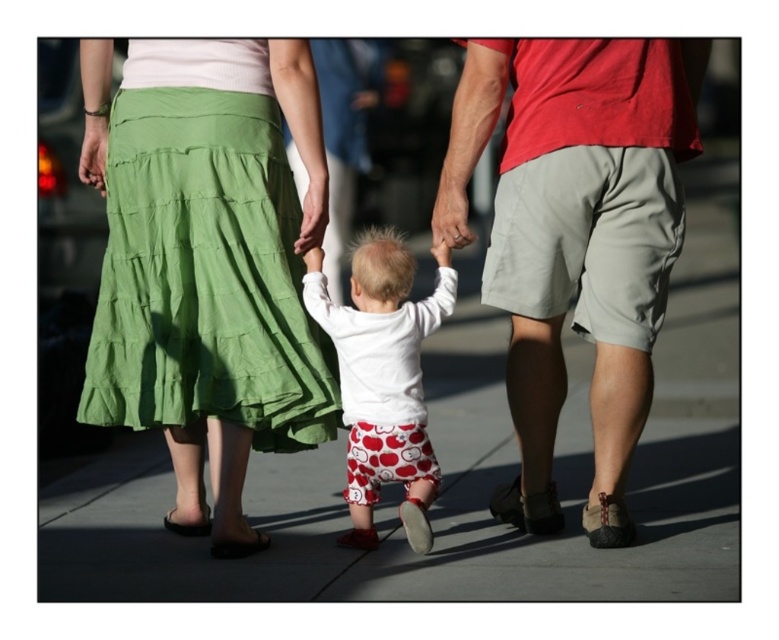
You are standing at the point labeled as point [460,474] which is the gray concrete pavement at center. If you want to walk towards the adults and the child, which direction should you go?

Since the gray concrete pavement at center is where you are standing, you should walk forward towards the adults and the child who are positioned ahead of you on the sidewalk.

You are a photographer trying to capture the scene from above. You need to decide which object, the white matte pants at center or the black leather sandal at lower left, will appear larger in the photo. Which one will you focus on?

The white matte pants at center is much taller than the black leather sandal at lower left, so it will appear larger in the photo.

You are a fashion designer observing the scene. You need to decide which item has a greater width between the green cotton skirt at upper left and the black leather sandal at lower center. Which one is wider?

The green cotton skirt at upper left has a greater width than the black leather sandal at lower center according to the description.